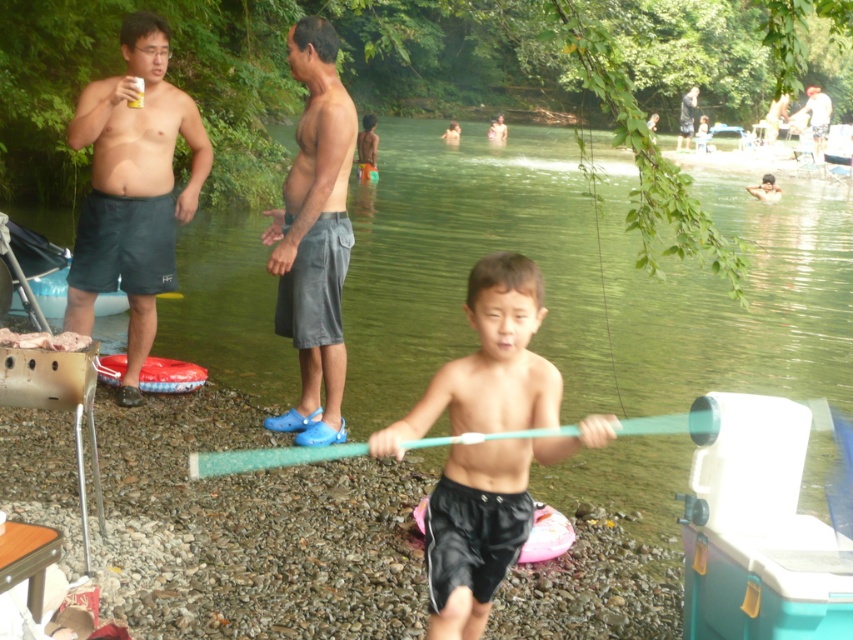
Question: Which object appears closest to the camera in this image?

Choices:
 (A) smooth blue shorts at center
 (B) black matte shorts at center
 (C) light brown wooden stick at center

Answer: (B)

Question: Considering the relative positions of gray fabric shorts at center and smooth blue shorts at center in the image provided, where is gray fabric shorts at center located with respect to smooth blue shorts at center?

Choices:
 (A) below
 (B) above

Answer: (A)

Question: Among these objects, which one is nearest to the camera?

Choices:
 (A) matte black shorts at left
 (B) light brown wooden stick at center
 (C) green translucent stick at center
 (D) black matte shorts at center

Answer: (D)

Question: Can you confirm if matte black shorts at left is bigger than gray fabric shorts at center?

Choices:
 (A) no
 (B) yes

Answer: (A)

Question: Does green translucent stick at center have a larger size compared to gray fabric shorts at center?

Choices:
 (A) yes
 (B) no

Answer: (A)

Question: Which point appears farthest from the camera in this image?

Choices:
 (A) (817, 150)
 (B) (679, 388)

Answer: (A)